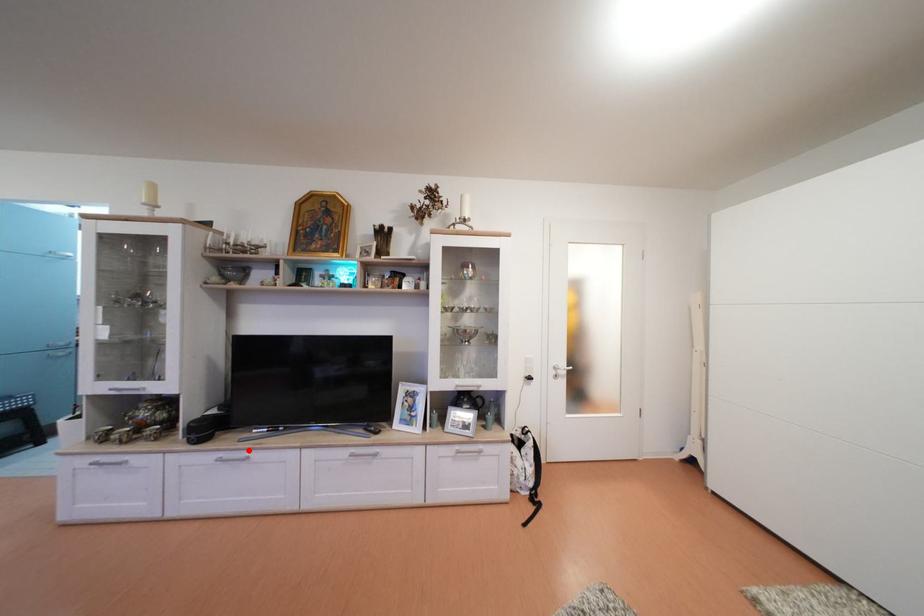
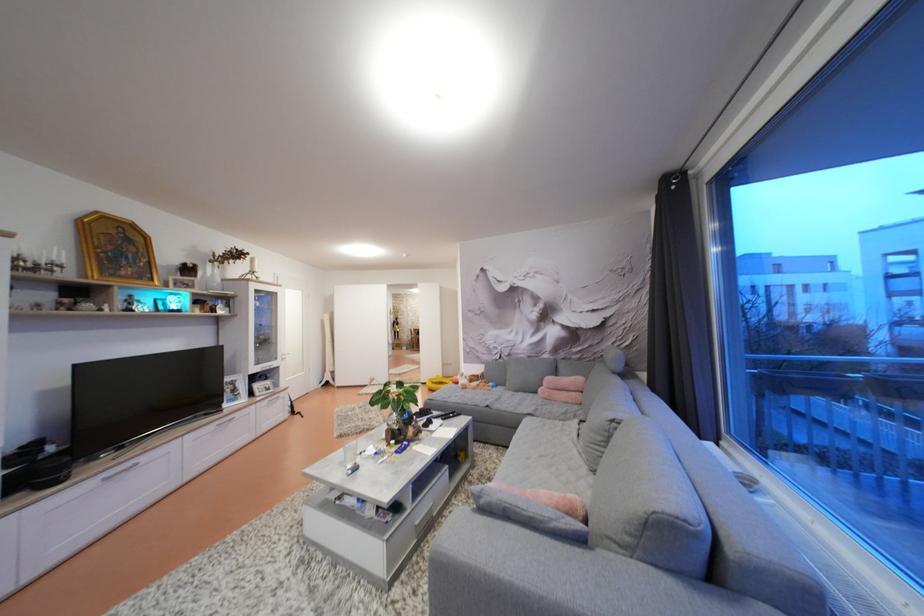
The point at the highlighted location is marked in the first image. Where is the corresponding point in the second image?

(126, 466)